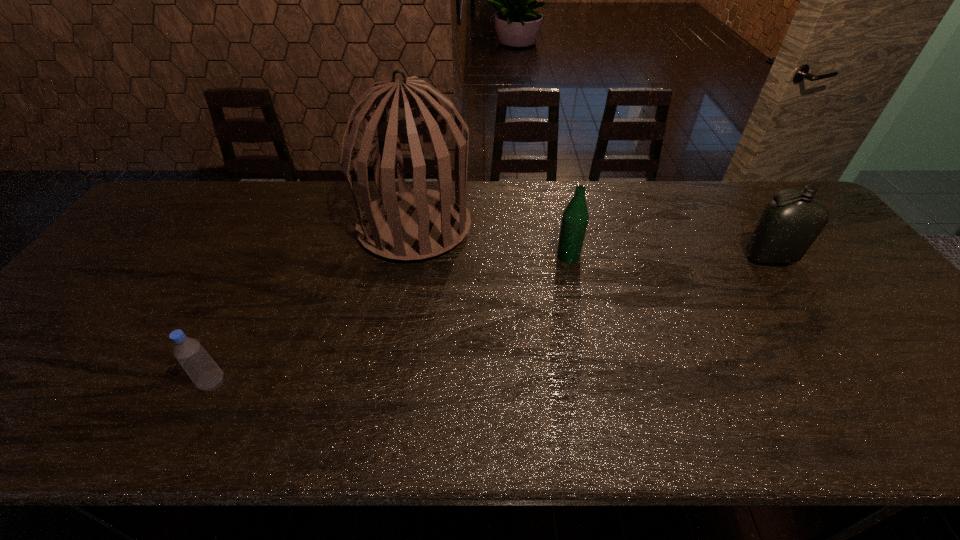
Locate an element on the screen. This screenshot has width=960, height=540. the tallest object is located at coordinates (415, 224).

Locate an element on the screen. birdcage is located at coordinates (415, 224).

This screenshot has width=960, height=540. Find the location of `the rightmost object`. the rightmost object is located at coordinates pyautogui.click(x=787, y=227).

Locate an element on the screen. The height and width of the screenshot is (540, 960). the second bottle from right to left is located at coordinates (575, 217).

Locate an element on the screen. the nearest object is located at coordinates (204, 372).

Find the location of a particular element. This screenshot has height=540, width=960. the nearest bottle is located at coordinates (204, 372).

Where is `vacant space positioned on the left of the tallest object`? The image size is (960, 540). vacant space positioned on the left of the tallest object is located at coordinates (228, 226).

Find the location of a particular element. vacant space located on the left of the rightmost bottle is located at coordinates (669, 258).

Locate an element on the screen. This screenshot has height=540, width=960. vacant region located on the back of the third object from left to right is located at coordinates (556, 198).

At what (x,y) coordinates should I click in order to perform the action: click on vacant area situated on the left of the leftmost bottle. Please return your answer as a coordinate pair (x, y). The width and height of the screenshot is (960, 540). Looking at the image, I should click on (169, 383).